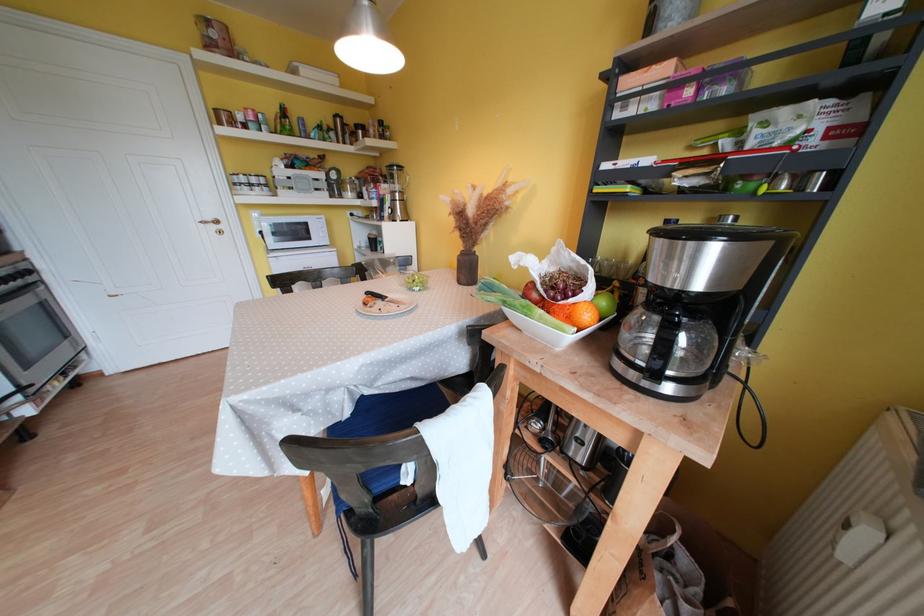
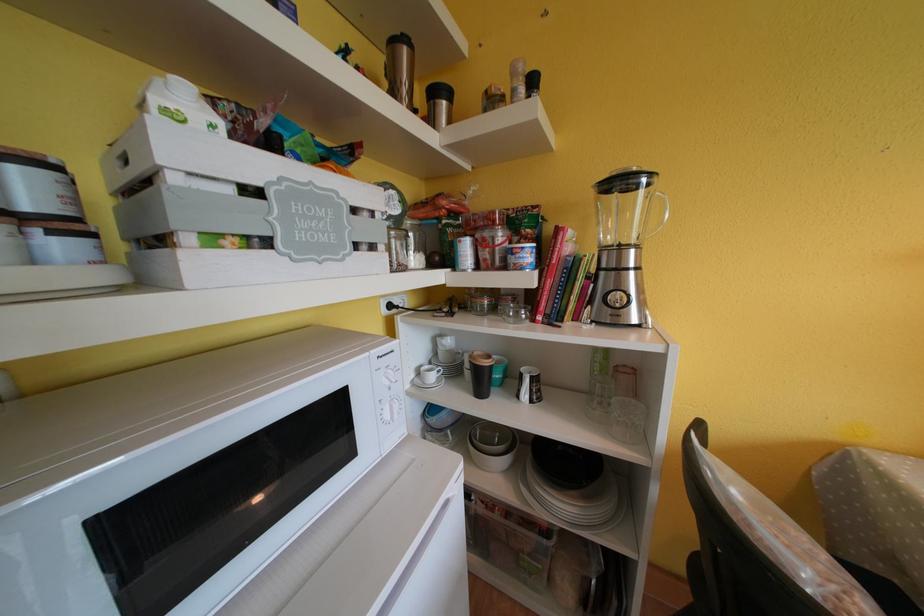
In a continuous first-person perspective shot, in which direction is the camera moving?

The movement direction of the cameraman is left, forward.